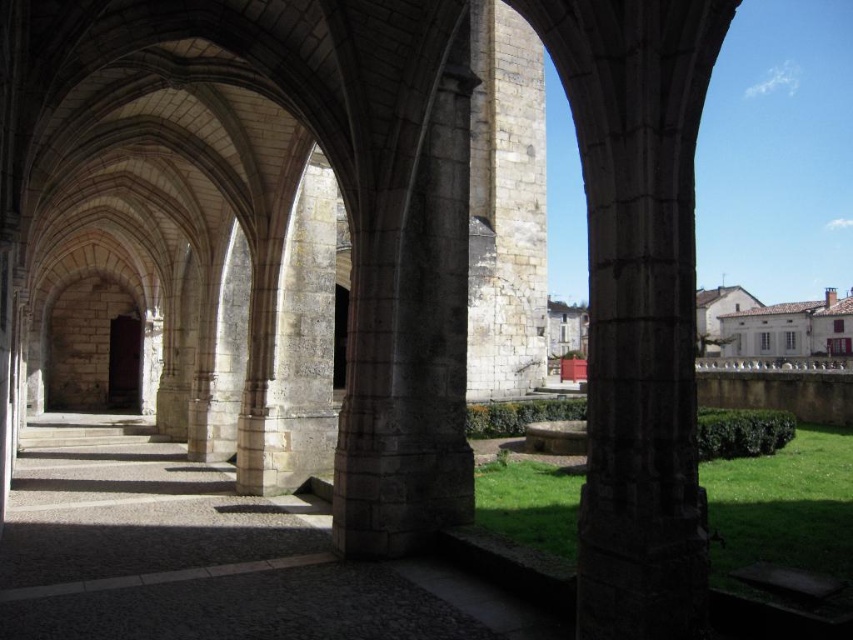
Question: Is gray stone pillar at center below white stone building at lower right?

Choices:
 (A) yes
 (B) no

Answer: (B)

Question: Which point is closer to the camera?

Choices:
 (A) (376, 220)
 (B) (796, 339)

Answer: (A)

Question: Considering the relative positions of gray stone pillar at center and white stone building at lower right in the image provided, where is gray stone pillar at center located with respect to white stone building at lower right?

Choices:
 (A) below
 (B) above

Answer: (B)

Question: Is gray stone pillar at center below white stone building at lower right?

Choices:
 (A) yes
 (B) no

Answer: (B)